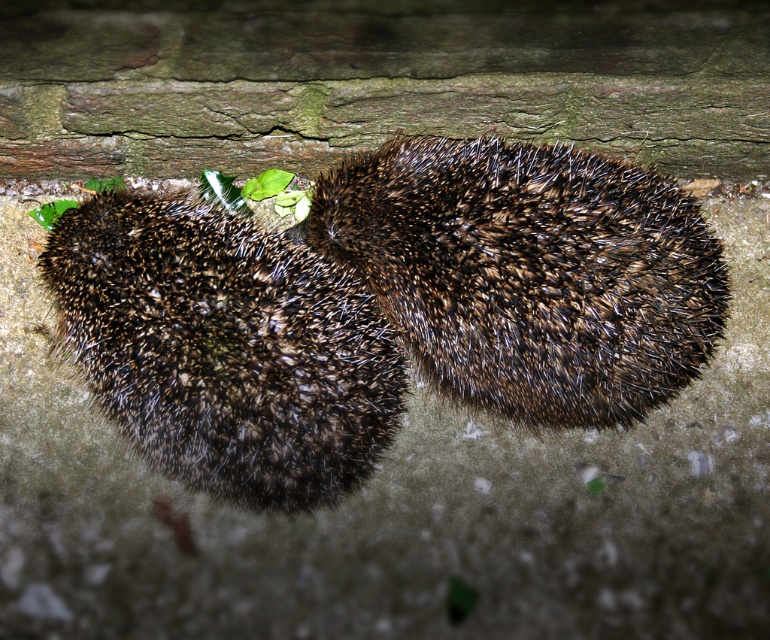
The height and width of the screenshot is (640, 770). What do you see at coordinates (529, 273) in the screenshot?
I see `brown spiny hedgehog at center` at bounding box center [529, 273].

In the scene shown: Does brown spiny hedgehog at center have a lesser height compared to brown spiny hedgehog at left?

Correct, brown spiny hedgehog at center is not as tall as brown spiny hedgehog at left.

Does point (591, 304) come farther from viewer compared to point (149, 376)?

That is True.

At what (x,y) coordinates should I click in order to perform the action: click on brown spiny hedgehog at center. Please return your answer as a coordinate pair (x, y). Looking at the image, I should click on (529, 273).